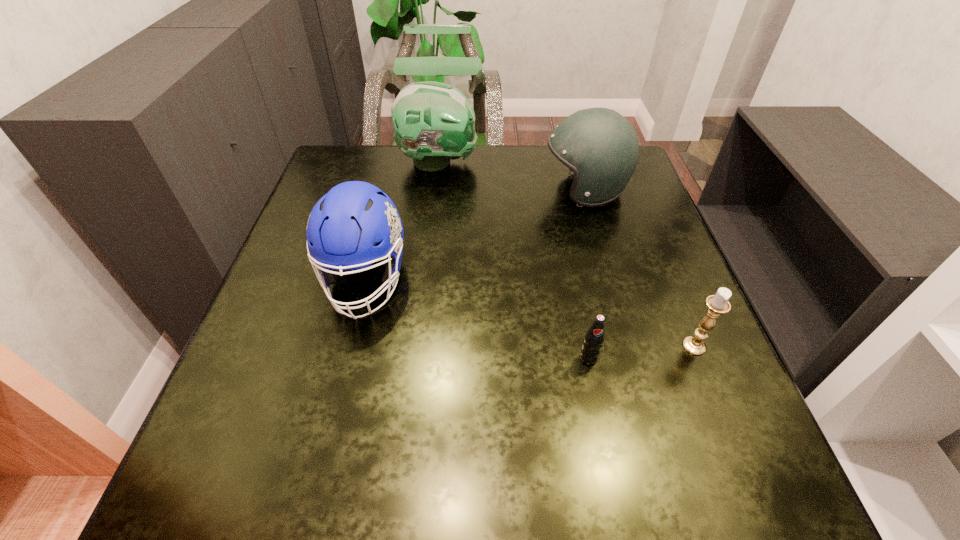
The image size is (960, 540). Find the location of `vacant area that lies between the candle holder and the pop`. vacant area that lies between the candle holder and the pop is located at coordinates (641, 352).

This screenshot has height=540, width=960. Find the location of `free space between the candle holder and the rightmost football helmet`. free space between the candle holder and the rightmost football helmet is located at coordinates (639, 268).

You are a GUI agent. You are given a task and a screenshot of the screen. Output one action in this format:
    pyautogui.click(x=<x>, y=<y>)
    Task: Click on the free space between the rightmost football helmet and the fourth tallest object
    Image resolution: width=960 pixels, height=540 pixels.
    Given the screenshot: What is the action you would take?
    pyautogui.click(x=639, y=268)

Where is `object that stands as the second closest to the nearest football helmet`? object that stands as the second closest to the nearest football helmet is located at coordinates [599, 145].

Locate an element on the screen. The height and width of the screenshot is (540, 960). object that can be found as the closest to the rightmost football helmet is located at coordinates (434, 122).

Find the location of a particular element. football helmet that is the second closest to the shortest object is located at coordinates (599, 145).

Select which football helmet appears as the closest to the rightmost football helmet. Please provide its 2D coordinates. Your answer should be formatted as a tuple, i.e. [(x, y)], where the tuple contains the x and y coordinates of a point satisfying the conditions above.

[(434, 122)]

This screenshot has height=540, width=960. I want to click on free space that satisfies the following two spatial constraints: 1. at the face opening of the rightmost football helmet; 2. on the front label of the pop, so click(632, 357).

Find the location of `free space that satisfies the following two spatial constraints: 1. at the face opening of the rightmost football helmet; 2. on the front label of the shortest object`. free space that satisfies the following two spatial constraints: 1. at the face opening of the rightmost football helmet; 2. on the front label of the shortest object is located at coordinates (632, 357).

Find the location of a particular element. vacant area in the image that satisfies the following two spatial constraints: 1. at the face opening of the rightmost football helmet; 2. on the front label of the shortest object is located at coordinates (632, 357).